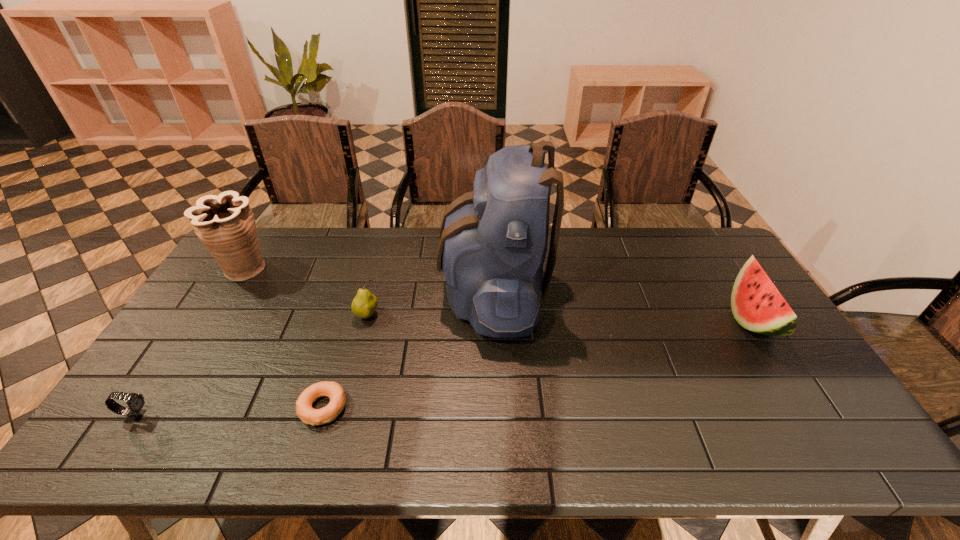
You are a GUI agent. You are given a task and a screenshot of the screen. Output one action in this format:
    pyautogui.click(x=<x>, y=<y>)
    Task: Click on the tallest object
    The height and width of the screenshot is (540, 960).
    Given the screenshot: What is the action you would take?
    pyautogui.click(x=493, y=241)

At what (x,y) coordinates should I click in order to perform the action: click on backpack. Please return your answer as a coordinate pair (x, y). This screenshot has height=540, width=960. Looking at the image, I should click on [x=493, y=241].

Where is `the fifth shortest object`? The image size is (960, 540). the fifth shortest object is located at coordinates pos(225,224).

Locate an element on the screen. The image size is (960, 540). watermelon is located at coordinates (757, 305).

This screenshot has height=540, width=960. Identify the location of the rightmost object. (757, 305).

This screenshot has width=960, height=540. I want to click on pear, so click(365, 303).

Find the location of a particular element. The image size is (960, 540). watch is located at coordinates (135, 402).

Locate an element on the screen. The height and width of the screenshot is (540, 960). bagel is located at coordinates (333, 390).

Find the location of a particular element. vacant region located at the front pocket of the fifth object from left to right is located at coordinates (329, 291).

The image size is (960, 540). In order to click on free space located 0.390m at the front pocket of the fifth object from left to right in this screenshot , I will do `click(320, 291)`.